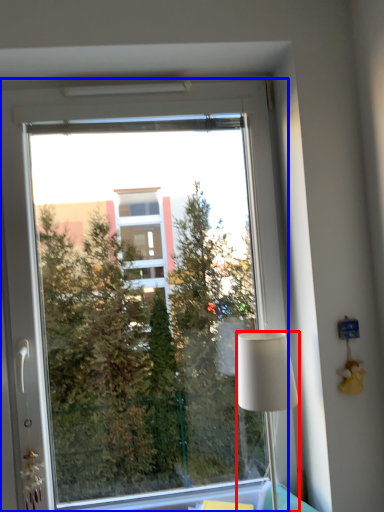
Question: Among these objects, which one is farthest to the camera, lamp (highlighted by a red box) or window (highlighted by a blue box)?

Choices:
 (A) lamp
 (B) window

Answer: (B)